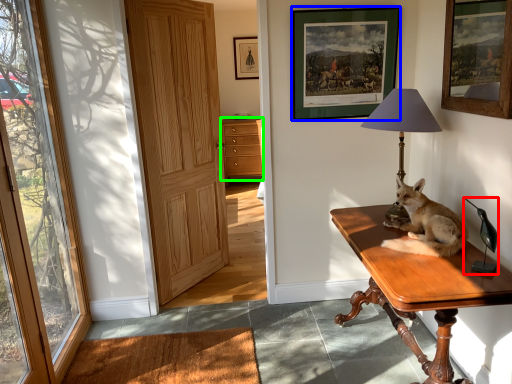
Question: Which object is positioned closest to corded phone (highlighted by a red box)? Select from picture frame (highlighted by a blue box) and cabinetry (highlighted by a green box).

Choices:
 (A) picture frame
 (B) cabinetry

Answer: (A)